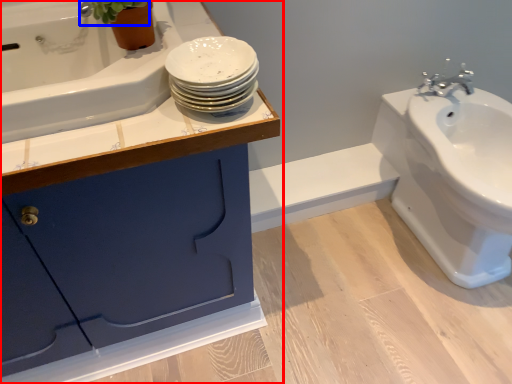
Question: Which object is closer to the camera taking this photo, bathroom cabinet (highlighted by a red box) or plant (highlighted by a blue box)?

Choices:
 (A) bathroom cabinet
 (B) plant

Answer: (A)